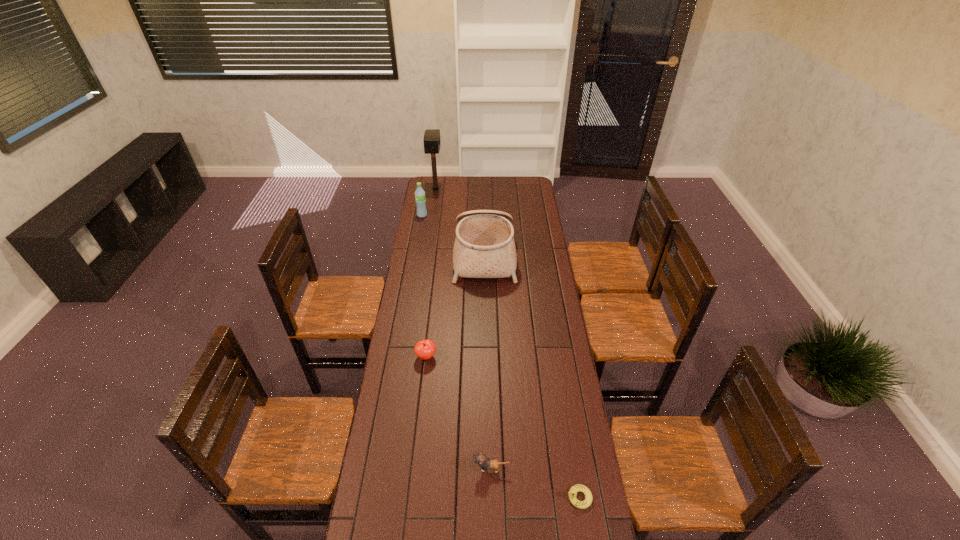
Image resolution: width=960 pixels, height=540 pixels. I want to click on vacant area between the fifth nearest object and the apple, so (424, 286).

At what (x,y) coordinates should I click in order to perform the action: click on the second closest object to the mallet. Please return your answer as a coordinate pair (x, y). The image size is (960, 540). Looking at the image, I should click on (484, 247).

Identify which object is located as the fourth nearest to the kitten. Please provide its 2D coordinates. Your answer should be formatted as a tuple, i.e. [(x, y)], where the tuple contains the x and y coordinates of a point satisfying the conditions above.

[(420, 199)]

Identify the location of free space that satisfies the following two spatial constraints: 1. with the lid open on the basket; 2. on the front side of the third nearest object. The width and height of the screenshot is (960, 540). (486, 356).

Where is `vacant position in the image that satisfies the following two spatial constraints: 1. with the lid open on the basket; 2. on the front side of the apple`? The image size is (960, 540). vacant position in the image that satisfies the following two spatial constraints: 1. with the lid open on the basket; 2. on the front side of the apple is located at coordinates tap(486, 356).